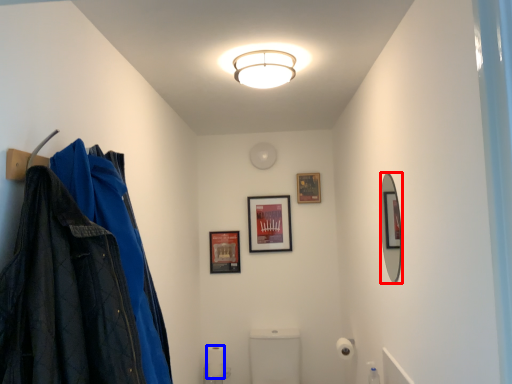
Question: Which of the following is the farthest to the observer, mirror (highlighted by a red box) or toilet paper (highlighted by a blue box)?

Choices:
 (A) mirror
 (B) toilet paper

Answer: (B)